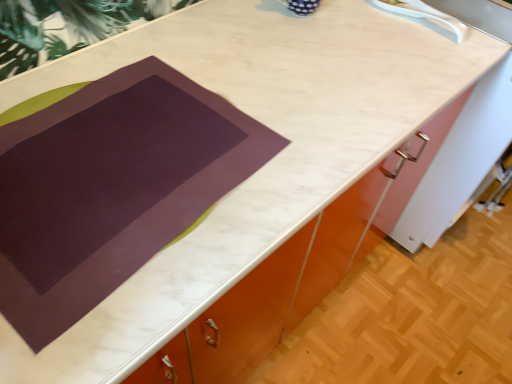
Measure the distance between purple matte placemat at center and camera.

17.93 inches.

I want to click on purple matte placemat at center, so click(x=111, y=187).

What is the approximate height of purple matte placemat at center?

purple matte placemat at center is 1.15 inches tall.

What do you see at coordinates (111, 187) in the screenshot? Image resolution: width=512 pixels, height=384 pixels. I see `purple matte placemat at center` at bounding box center [111, 187].

Find the location of a particular element. white plastic sink at upper right is located at coordinates (460, 14).

What do you see at coordinates (460, 14) in the screenshot? This screenshot has width=512, height=384. I see `white plastic sink at upper right` at bounding box center [460, 14].

At what (x,y) coordinates should I click in order to perform the action: click on purple matte placemat at center. Please return your answer as a coordinate pair (x, y). The height and width of the screenshot is (384, 512). Looking at the image, I should click on (111, 187).

Based on their positions, is purple matte placemat at center located to the left or right of white plastic sink at upper right?

Clearly, purple matte placemat at center is on the left of white plastic sink at upper right in the image.

Considering the relative positions of purple matte placemat at center and white plastic sink at upper right in the image provided, is purple matte placemat at center in front of white plastic sink at upper right?

Yes, it is in front of white plastic sink at upper right.

Which point is more forward, (141, 258) or (430, 10)?

The point (141, 258) is more forward.

From the image's perspective, is purple matte placemat at center above or below white plastic sink at upper right?

purple matte placemat at center is below white plastic sink at upper right.

From a real-world perspective, is purple matte placemat at center below white plastic sink at upper right?

Yes, from a real-world perspective, purple matte placemat at center is under white plastic sink at upper right.

Considering the sizes of objects purple matte placemat at center and white plastic sink at upper right in the image provided, who is wider, purple matte placemat at center or white plastic sink at upper right?

With larger width is purple matte placemat at center.

Can you confirm if purple matte placemat at center is taller than white plastic sink at upper right?

No, purple matte placemat at center is not taller than white plastic sink at upper right.

Considering the relative sizes of purple matte placemat at center and white plastic sink at upper right in the image provided, is purple matte placemat at center smaller than white plastic sink at upper right?

Actually, purple matte placemat at center might be larger than white plastic sink at upper right.

Is white plastic sink at upper right inside purple matte placemat at center?

No, white plastic sink at upper right is not surrounded by purple matte placemat at center.

Are purple matte placemat at center and white plastic sink at upper right far apart?

They are positioned close to each other.

Is purple matte placemat at center turned away from white plastic sink at upper right?

No, white plastic sink at upper right is not at the back of purple matte placemat at center.

This screenshot has height=384, width=512. What are the coordinates of `blanket that is in front of the white plastic sink at upper right` in the screenshot? It's located at (111, 187).

Which is more to the right, white plastic sink at upper right or purple matte placemat at center?

white plastic sink at upper right.

Between white plastic sink at upper right and purple matte placemat at center, which one is positioned behind?

white plastic sink at upper right is further from the camera.

Which point is more forward, [385,6] or [124,166]?

Answer: Point [124,166]

From the image's perspective, is white plastic sink at upper right positioned above or below purple matte placemat at center?

Based on their image positions, white plastic sink at upper right is located above purple matte placemat at center.

From a real-world perspective, is white plastic sink at upper right located beneath purple matte placemat at center?

Actually, white plastic sink at upper right is physically above purple matte placemat at center in the real world.

Which object is wider, white plastic sink at upper right or purple matte placemat at center?

Wider between the two is purple matte placemat at center.

Which of these two, white plastic sink at upper right or purple matte placemat at center, stands shorter?

purple matte placemat at center is shorter.

Looking at the image, does white plastic sink at upper right seem bigger or smaller compared to purple matte placemat at center?

Clearly, white plastic sink at upper right is smaller in size than purple matte placemat at center.

Would you say white plastic sink at upper right is outside purple matte placemat at center?

Yes.

Is white plastic sink at upper right next to purple matte placemat at center and touching it?

There is a gap between white plastic sink at upper right and purple matte placemat at center.

Is white plastic sink at upper right turned away from purple matte placemat at center?

No, white plastic sink at upper right's orientation is not away from purple matte placemat at center.

Where is `blanket in front of the white plastic sink at upper right`? blanket in front of the white plastic sink at upper right is located at coordinates (111, 187).

This screenshot has height=384, width=512. Identify the location of blanket below the white plastic sink at upper right (from the image's perspective). (111, 187).

The image size is (512, 384). I want to click on sink that is above the purple matte placemat at center (from the image's perspective), so click(460, 14).